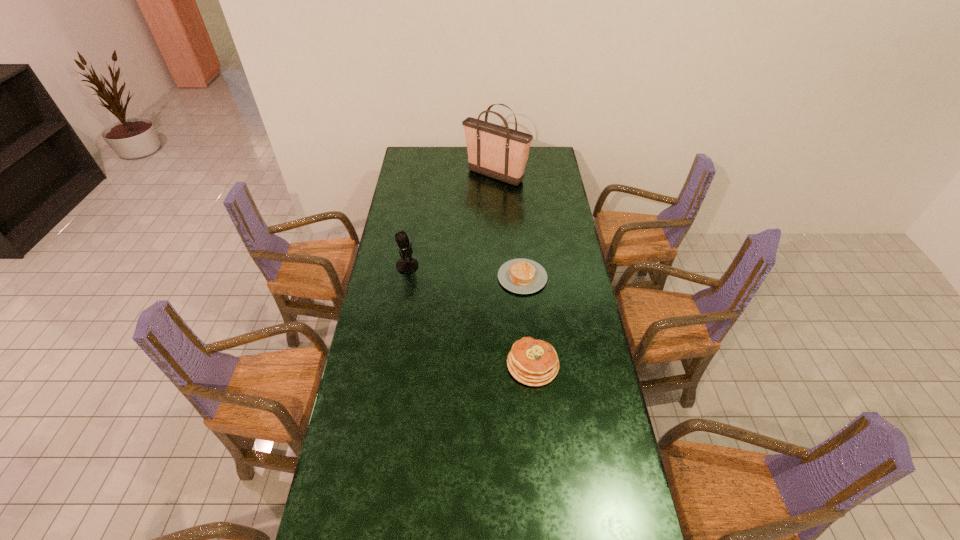
Image resolution: width=960 pixels, height=540 pixels. In order to click on free space located on the back of the nearest object in this screenshot , I will do `click(526, 293)`.

I want to click on vacant area situated 0.060m on the right of the shortest object, so click(562, 277).

At what (x,y) coordinates should I click in order to perform the action: click on object present at the far edge. Please return your answer as a coordinate pair (x, y). Looking at the image, I should click on (499, 152).

The image size is (960, 540). I want to click on object that is positioned at the left edge, so click(x=407, y=264).

Locate an element on the screen. vacant area at the far edge of the desktop is located at coordinates (444, 148).

This screenshot has width=960, height=540. Find the location of `vacant space at the left edge`. vacant space at the left edge is located at coordinates (383, 268).

Locate an element on the screen. free point at the right edge is located at coordinates (548, 247).

The image size is (960, 540). I want to click on vacant area that lies between the leftmost object and the tallest object, so click(x=451, y=221).

Locate an element on the screen. free space between the microphone and the tallest object is located at coordinates (451, 221).

Where is `free area in between the farther pancake and the microphone`? free area in between the farther pancake and the microphone is located at coordinates (465, 272).